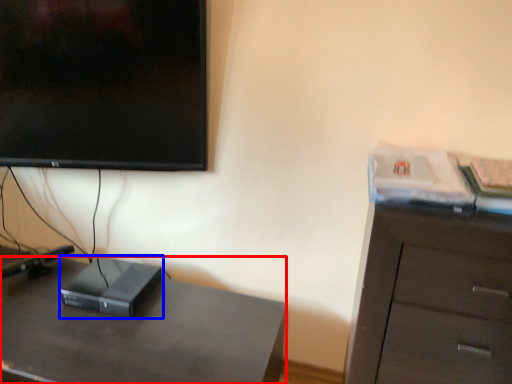
Question: Which object is further to the camera taking this photo, desk (highlighted by a red box) or computer (highlighted by a blue box)?

Choices:
 (A) desk
 (B) computer

Answer: (B)